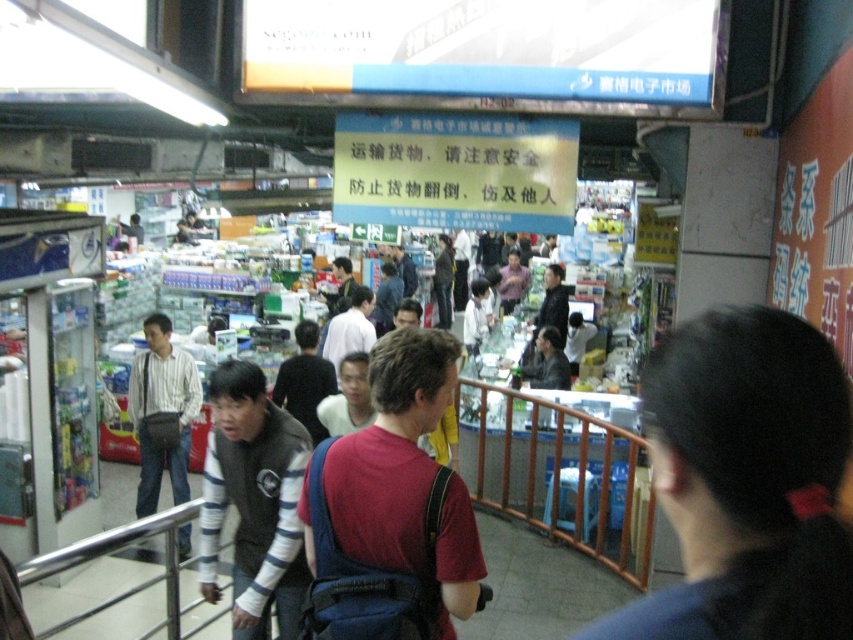
You are observing a crowded market scene. There is a person with dark brown hair at center and another wearing a red fabric shirt at center. Which of these two has a smaller width?

The dark brown hair at center has a lesser width compared to the red fabric shirt at center.

What are the coordinates of the dark brown hair at center in the image?

The dark brown hair at center is located at coordinates point (x=746, y=481).

You are a photographer standing in the market and want to capture both the dark brown hair at center and the red fabric shirt at center in a single photo. Based on their positions, which one is closer to the camera?

The dark brown hair at center is located above the red fabric shirt at center, so it is closer to the camera.